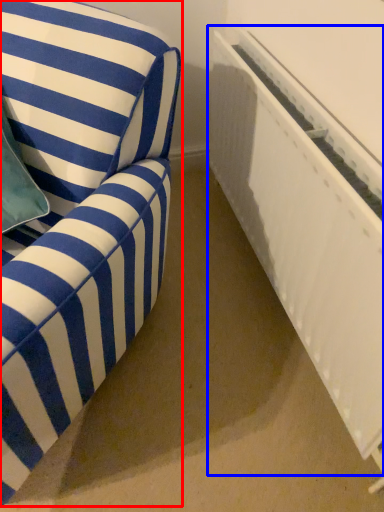
Question: Which point is closer to the camera, furniture (highlighted by a red box) or radiator (highlighted by a blue box)?

Choices:
 (A) furniture
 (B) radiator

Answer: (A)